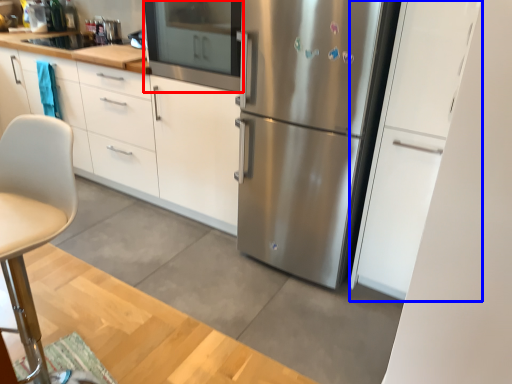
Question: Which of the following is the farthest to the observer, oven (highlighted by a red box) or cabinetry (highlighted by a blue box)?

Choices:
 (A) oven
 (B) cabinetry

Answer: (A)